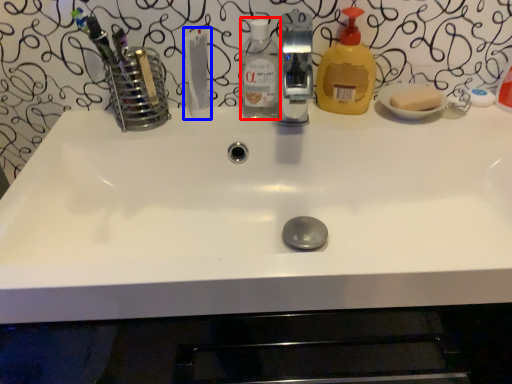
Question: Which object appears closest to the camera in this image, bottle (highlighted by a red box) or toothpaste (highlighted by a blue box)?

Choices:
 (A) bottle
 (B) toothpaste

Answer: (B)